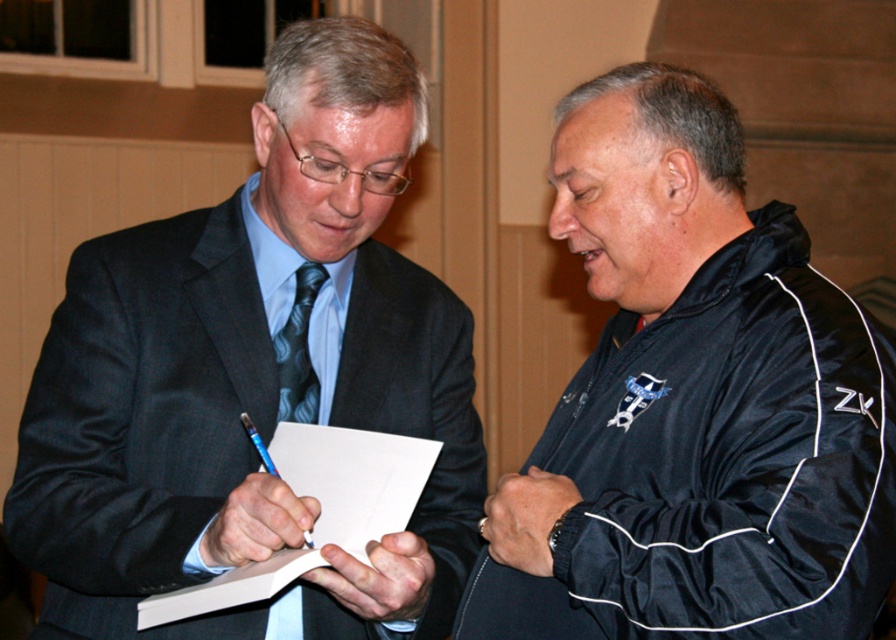
Which is more to the right, matte black suit at center or white paper at center?

white paper at center is more to the right.

Does point (88, 465) come in front of point (166, 609)?

No, (88, 465) is further to viewer.

Image resolution: width=896 pixels, height=640 pixels. What are the coordinates of `matte black suit at center` in the screenshot? It's located at (253, 376).

Is point (325, 141) more distant than point (618, 452)?

Yes, it is.

How much distance is there between matte black suit at center and black fabric jacket at right?

matte black suit at center and black fabric jacket at right are 19.79 inches apart.

Is point (235, 227) farther from viewer compared to point (648, 470)?

Yes.

Locate an element on the screen. The image size is (896, 640). matte black suit at center is located at coordinates (253, 376).

Who is more distant from viewer, (x=589, y=208) or (x=289, y=369)?

The point (x=289, y=369) is behind.

The height and width of the screenshot is (640, 896). What do you see at coordinates (694, 403) in the screenshot?
I see `black fabric jacket at right` at bounding box center [694, 403].

Who is more distant from viewer, (x=780, y=512) or (x=293, y=339)?

The point (x=293, y=339) is behind.

Identify the location of black fabric jacket at right. The height and width of the screenshot is (640, 896). (694, 403).